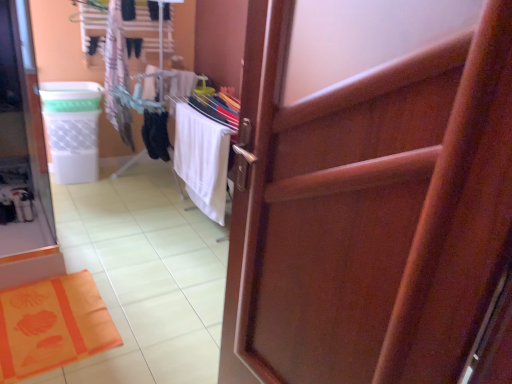
Question: Is white plastic laundry basket at left wider than white fabric beach towel at center?

Choices:
 (A) yes
 (B) no

Answer: (A)

Question: Is white plastic laundry basket at left beside white fabric beach towel at center?

Choices:
 (A) yes
 (B) no

Answer: (B)

Question: Can you confirm if white plastic laundry basket at left is bigger than white fabric beach towel at center?

Choices:
 (A) yes
 (B) no

Answer: (A)

Question: Is white fabric beach towel at center a part of white plastic laundry basket at left?

Choices:
 (A) no
 (B) yes

Answer: (A)

Question: Is white plastic laundry basket at left oriented away from white fabric beach towel at center?

Choices:
 (A) no
 (B) yes

Answer: (A)

Question: From a real-world perspective, is wooden door at center positioned above or below white plastic laundry basket at left?

Choices:
 (A) above
 (B) below

Answer: (A)

Question: From the image's perspective, is wooden door at center located above or below white plastic laundry basket at left?

Choices:
 (A) above
 (B) below

Answer: (B)

Question: Is wooden door at center spatially inside white plastic laundry basket at left, or outside of it?

Choices:
 (A) outside
 (B) inside

Answer: (A)

Question: Is wooden door at center wider or thinner than white plastic laundry basket at left?

Choices:
 (A) thin
 (B) wide

Answer: (A)

Question: Is white fabric beach towel at center wider or thinner than orange fabric bath mat at lower left?

Choices:
 (A) thin
 (B) wide

Answer: (A)

Question: From a real-world perspective, relative to orange fabric bath mat at lower left, is white fabric beach towel at center vertically above or below?

Choices:
 (A) above
 (B) below

Answer: (A)

Question: Considering the positions of white fabric beach towel at center and orange fabric bath mat at lower left in the image, is white fabric beach towel at center bigger or smaller than orange fabric bath mat at lower left?

Choices:
 (A) small
 (B) big

Answer: (B)

Question: Based on their positions, is white fabric beach towel at center located to the left or right of orange fabric bath mat at lower left?

Choices:
 (A) right
 (B) left

Answer: (A)

Question: Is white plastic laundry basket at left situated inside wooden door at center or outside?

Choices:
 (A) outside
 (B) inside

Answer: (A)

Question: In the image, is white plastic laundry basket at left on the left side or the right side of wooden door at center?

Choices:
 (A) left
 (B) right

Answer: (A)